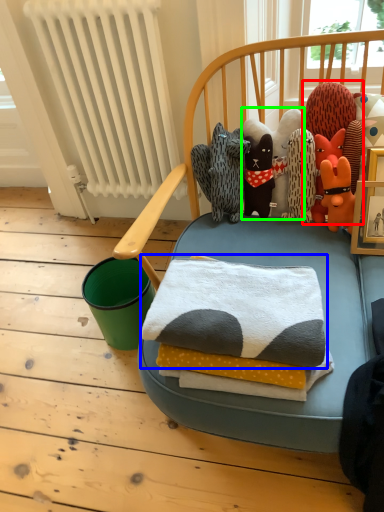
Question: Based on their relative distances, which object is farther from toy (highlighted by a red box)? Choose from bath towel (highlighted by a blue box) and toy (highlighted by a green box).

Choices:
 (A) bath towel
 (B) toy

Answer: (A)